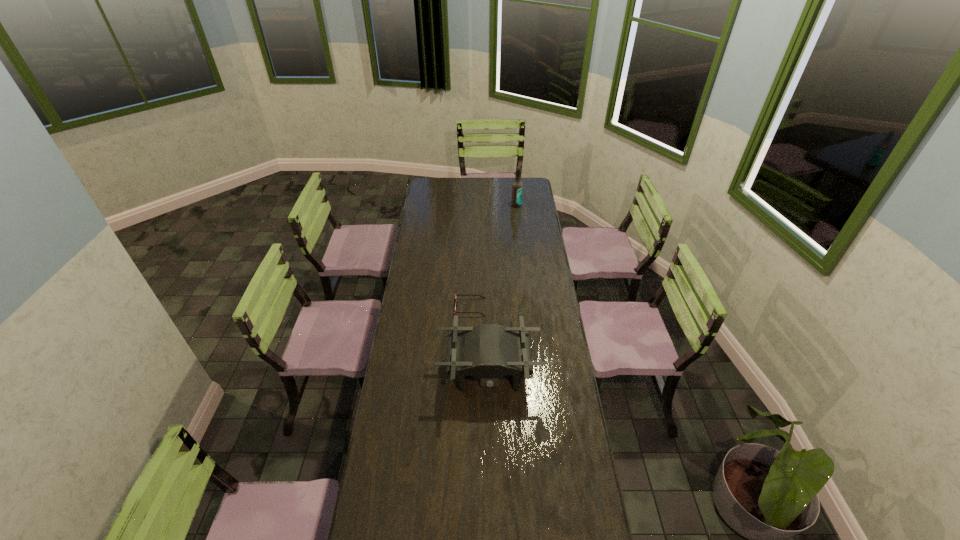
What are the coordinates of `the farthest object` in the screenshot? It's located at (517, 187).

At what (x,y) coordinates should I click in order to perform the action: click on beer bottle. Please return your answer as a coordinate pair (x, y). Image resolution: width=960 pixels, height=540 pixels. Looking at the image, I should click on (517, 187).

This screenshot has width=960, height=540. What are the coordinates of `the second shortest object` in the screenshot? It's located at (488, 351).

You are a GUI agent. You are given a task and a screenshot of the screen. Output one action in this format:
    pyautogui.click(x=<x>, y=<y>)
    Task: Click on the nearest object
    
    Given the screenshot: What is the action you would take?
    pyautogui.click(x=488, y=351)

The image size is (960, 540). What are the coordinates of `sunglasses` in the screenshot? It's located at (456, 295).

Find the location of a particular element. The height and width of the screenshot is (540, 960). the second farthest object is located at coordinates (456, 295).

Image resolution: width=960 pixels, height=540 pixels. I want to click on free space located on the label of the farthest object, so click(x=519, y=228).

Identify the location of free space located 0.140m with a camera mounted on the underside of the nearest object. This screenshot has width=960, height=540. (490, 441).

I want to click on blank space located 0.180m on the bridge of the second nearest object, so click(523, 307).

Where is `beer bottle located at the right edge`? The width and height of the screenshot is (960, 540). beer bottle located at the right edge is located at coordinates (517, 187).